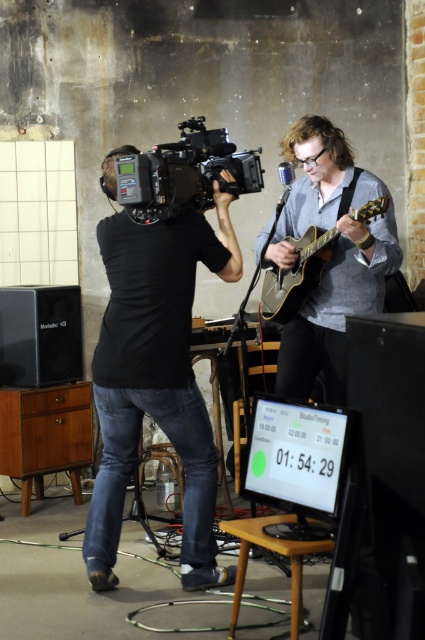
You are standing in the recording studio and want to place a small microphone stand between the two points labeled point (139, 241) and point (212, 131). Which point should the stand be closer to in order to ensure it is nearer to the camera?

The microphone stand should be placed closer to point (139, 241) because it is closer to the camera than point (212, 131).